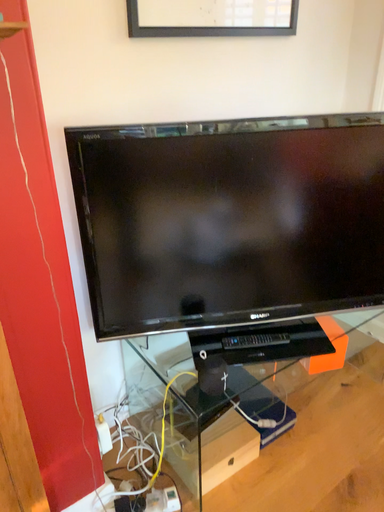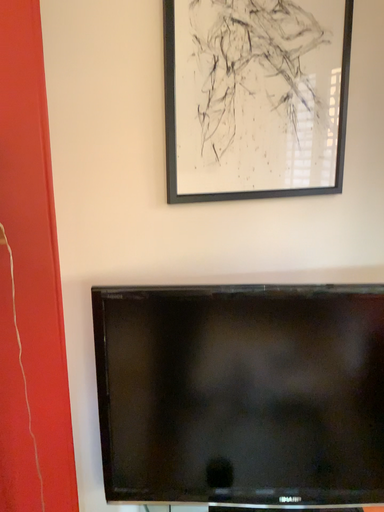
Question: How did the camera likely rotate when shooting the video?

Choices:
 (A) rotated left
 (B) rotated right

Answer: (A)